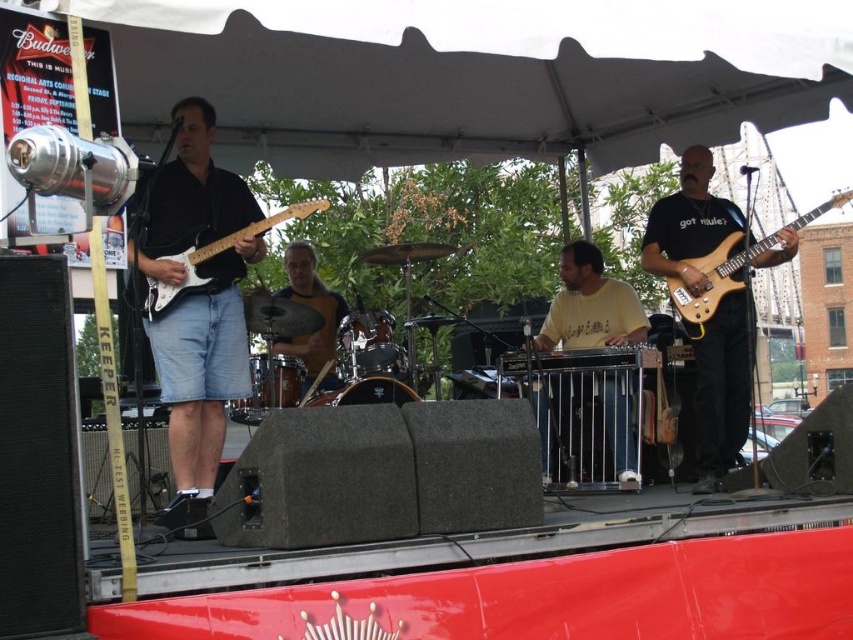
What do you see at coordinates (202, 372) in the screenshot? I see `matte black guitar at left` at bounding box center [202, 372].

Who is more distant from viewer, (177,216) or (567,406)?

Positioned behind is point (567,406).

Which is behind, point (235, 339) or point (605, 413)?

The point (605, 413) is behind.

You are a GUI agent. You are given a task and a screenshot of the screen. Output one action in this format:
    pyautogui.click(x=<x>, y=<y>)
    Task: Click on the matte black guitar at left
    Image resolution: width=853 pixels, height=640 pixels.
    Given the screenshot: What is the action you would take?
    pyautogui.click(x=202, y=372)

Which of these two, matte black guitar at right or light brown wood electric guitar at right, stands taller?

Standing taller between the two is light brown wood electric guitar at right.

How far apart are matte black guitar at right and light brown wood electric guitar at right?

matte black guitar at right is 3.89 meters from light brown wood electric guitar at right.

Between point (689, 166) and point (682, 280), which one is positioned behind?

Positioned behind is point (689, 166).

You are a GUI agent. You are given a task and a screenshot of the screen. Output one action in this format:
    pyautogui.click(x=<x>, y=<y>)
    Task: Click on the matte black guitar at right
    This screenshot has height=640, width=853.
    Given the screenshot: What is the action you would take?
    pyautogui.click(x=722, y=387)

Does matte black guitar at left come in front of white glossy electric guitar at left?

Yes, it is.

Is matte black guitar at left positioned behind white glossy electric guitar at left?

No, matte black guitar at left is in front of white glossy electric guitar at left.

Is point (169, 525) in front of point (221, 246)?

Yes, point (169, 525) is in front of point (221, 246).

Find the location of a particular element. matte black guitar at left is located at coordinates tap(202, 372).